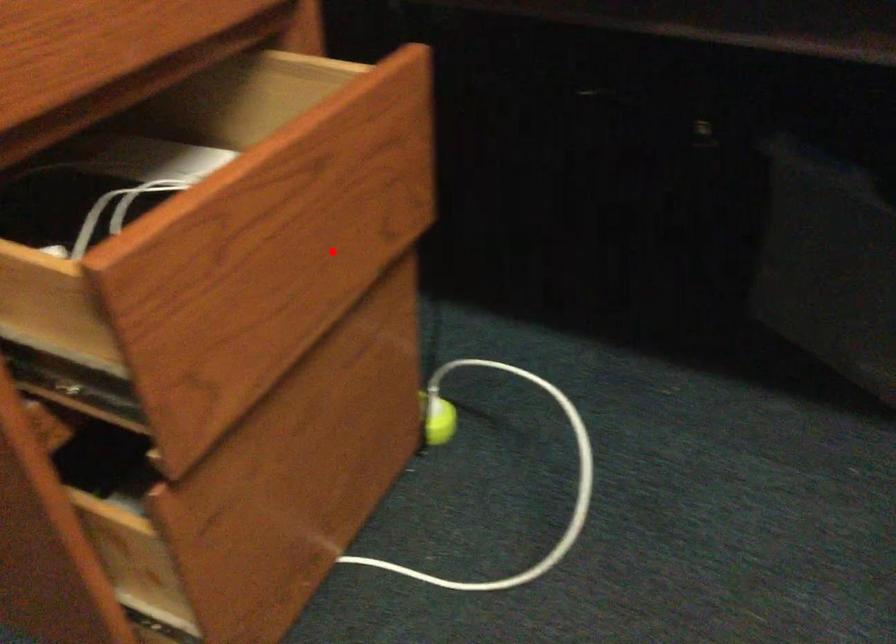
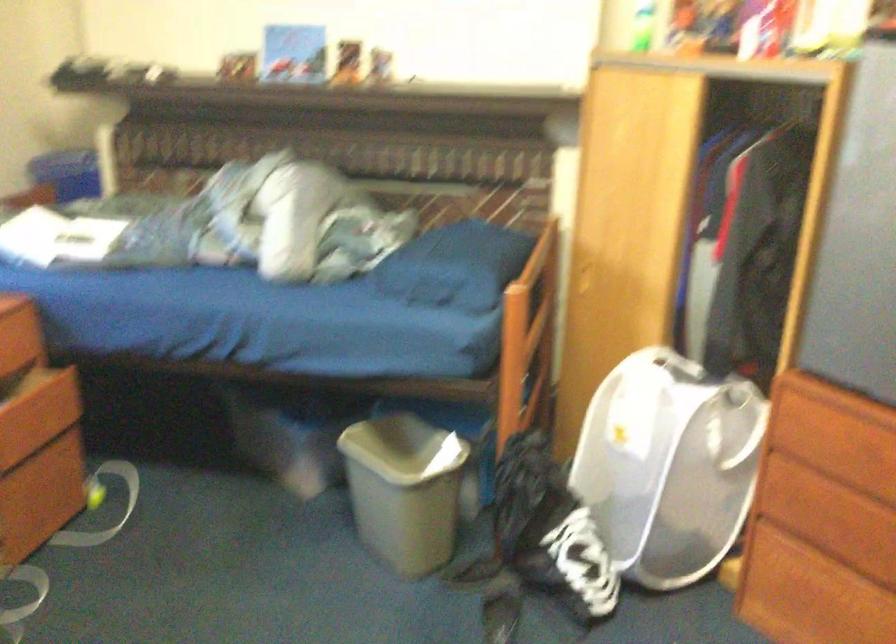
In the second image, find the point that corresponds to the highlighted location in the first image.

(39, 413)